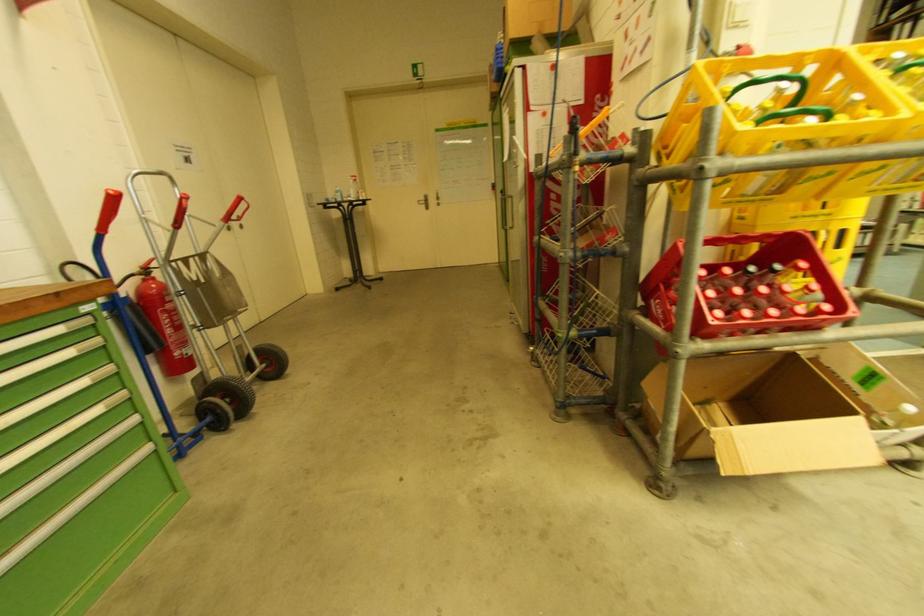
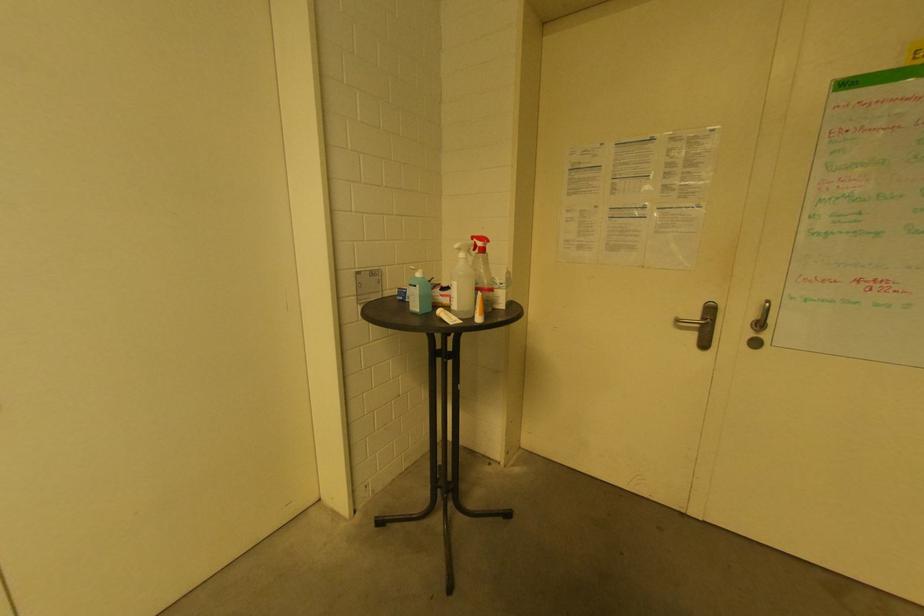
Find the pixel in the second image that matches pixel 420 204 in the first image.

(681, 323)